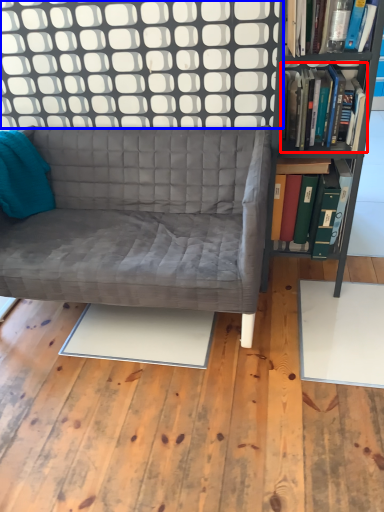
Question: Which object appears farthest to the camera in this image, book (highlighted by a red box) or glass door (highlighted by a blue box)?

Choices:
 (A) book
 (B) glass door

Answer: (B)